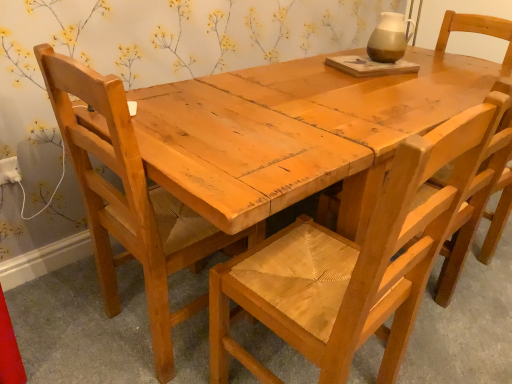
This screenshot has width=512, height=384. In order to click on free point to the left of natural wood chair at left, marked as the third chair in a right-to-left arrangement in this screenshot , I will do `click(70, 320)`.